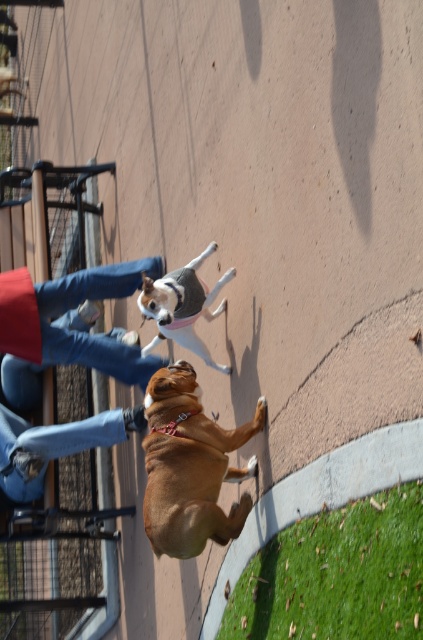
You are a photographer trying to capture both the brown leather dog at center and the soft gray sweater at center in a single shot. Based on their positions, which object should you focus on first to ensure both are in frame?

The brown leather dog at center is positioned under the soft gray sweater at center, so focusing on the sweater first will allow the dog to be captured below it in the frame.

You are an observer standing in the scene. You see the jeans at lower left and the soft gray sweater at center. Which item is closer to the ground?

The jeans at lower left is positioned under the soft gray sweater at center, so it is closer to the ground.